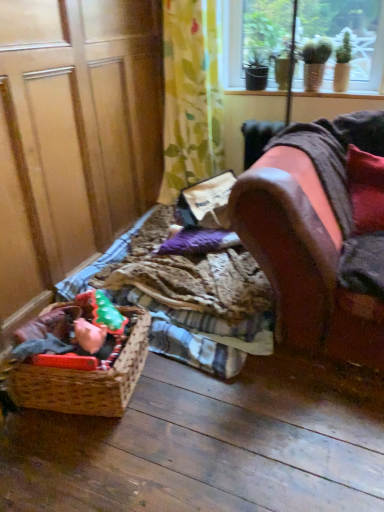
Question: Is matte red toy at lower left outside velvet red pillow at right?

Choices:
 (A) yes
 (B) no

Answer: (A)

Question: From the image's perspective, is matte red toy at lower left beneath velvet red pillow at right?

Choices:
 (A) no
 (B) yes

Answer: (B)

Question: Does matte red toy at lower left come in front of velvet red pillow at right?

Choices:
 (A) no
 (B) yes

Answer: (B)

Question: Is matte red toy at lower left shorter than velvet red pillow at right?

Choices:
 (A) no
 (B) yes

Answer: (B)

Question: Is velvet red pillow at right located within matte red toy at lower left?

Choices:
 (A) no
 (B) yes

Answer: (A)

Question: Is matte red toy at lower left wider than velvet red pillow at right?

Choices:
 (A) yes
 (B) no

Answer: (B)

Question: From a real-world perspective, is green floral fabric at upper center located higher than velvet red pillow at right?

Choices:
 (A) no
 (B) yes

Answer: (B)

Question: Is green floral fabric at upper center behind velvet red pillow at right?

Choices:
 (A) no
 (B) yes

Answer: (B)

Question: Is green floral fabric at upper center next to velvet red pillow at right?

Choices:
 (A) no
 (B) yes

Answer: (A)

Question: Is green floral fabric at upper center positioned beyond the bounds of velvet red pillow at right?

Choices:
 (A) yes
 (B) no

Answer: (A)

Question: Is green floral fabric at upper center surrounding velvet red pillow at right?

Choices:
 (A) no
 (B) yes

Answer: (A)

Question: Can you confirm if green floral fabric at upper center is bigger than velvet red pillow at right?

Choices:
 (A) no
 (B) yes

Answer: (B)

Question: Can you confirm if plaid fabric at lower left is shorter than leather couch at right?

Choices:
 (A) yes
 (B) no

Answer: (A)